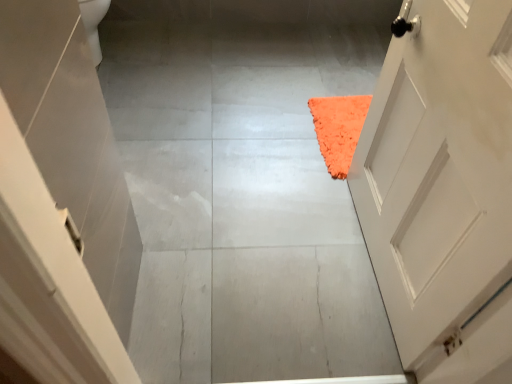
Image resolution: width=512 pixels, height=384 pixels. I want to click on gray polished concrete at center, so (x=244, y=187).

Measure the distance between point (x=284, y=33) and camera.

A distance of 2.60 meters exists between point (x=284, y=33) and camera.

This screenshot has height=384, width=512. What do you see at coordinates (244, 187) in the screenshot? I see `gray polished concrete at center` at bounding box center [244, 187].

Where is `gray polished concrete at center`? The height and width of the screenshot is (384, 512). gray polished concrete at center is located at coordinates (244, 187).